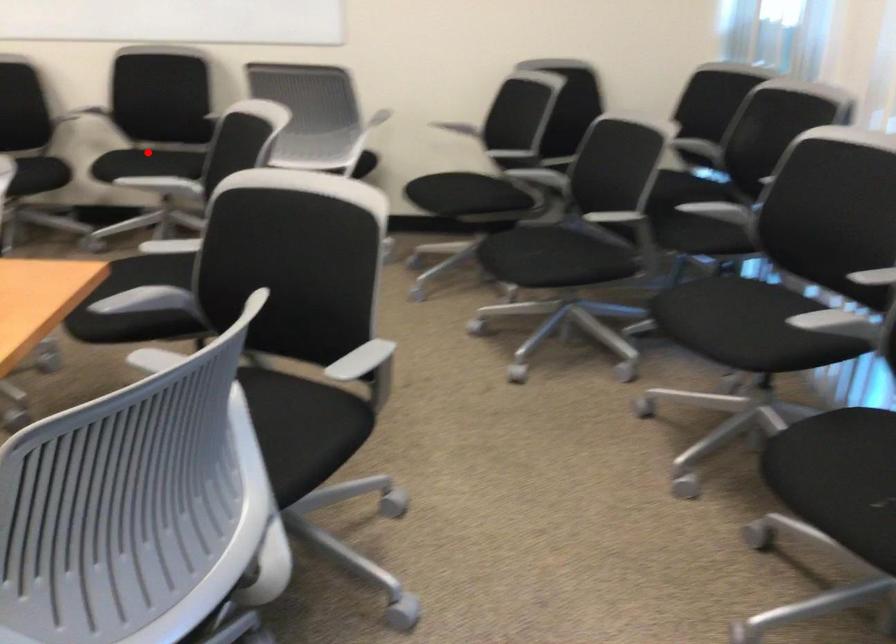
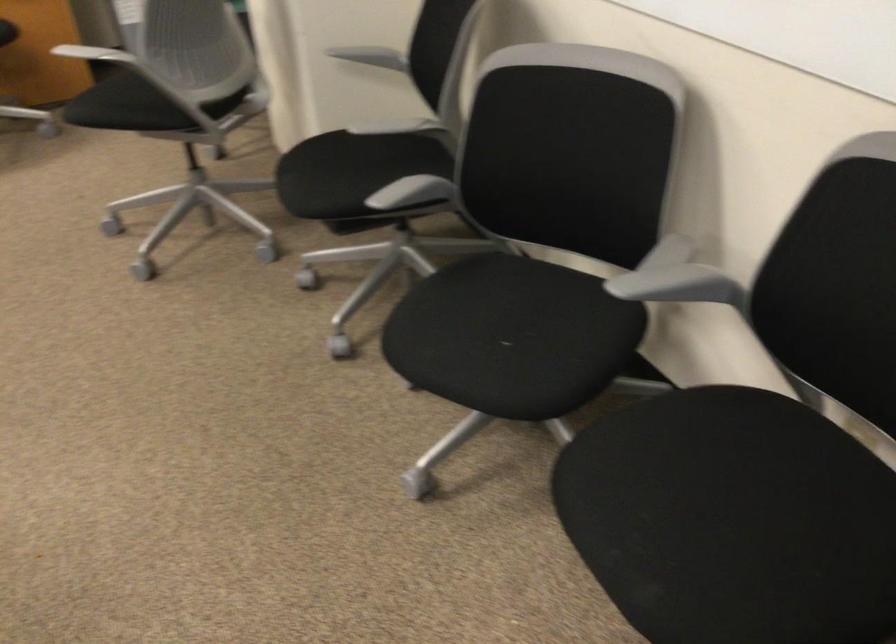
Question: A red point is marked in image1. In image2, is the corresponding 3D point closer to the camera or farther? Reply with the corresponding letter.

Choices:
 (A) The corresponding 3D point is closer.
 (B) The corresponding 3D point is farther.

Answer: (A)